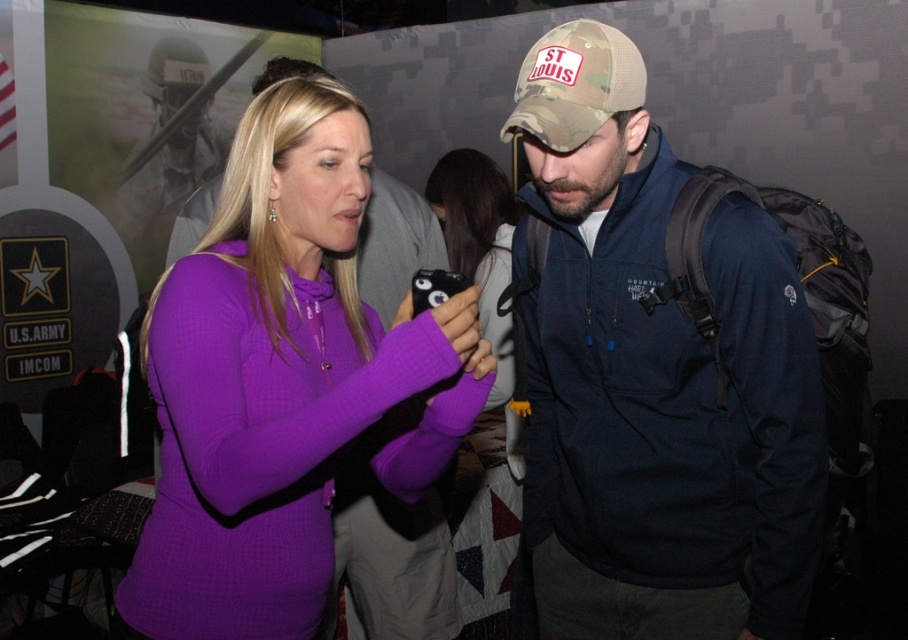
Question: Is purple fleece sweater at center further to camera compared to camo fabric baseball cap at center?

Choices:
 (A) no
 (B) yes

Answer: (A)

Question: Considering the relative positions of camo fabric hat at center and purple fleece sweater at center in the image provided, where is camo fabric hat at center located with respect to purple fleece sweater at center?

Choices:
 (A) below
 (B) above

Answer: (B)

Question: Which object is closer to the camera taking this photo?

Choices:
 (A) camo fabric baseball cap at center
 (B) purple fleece sweater at center
 (C) camo fabric hat at center
 (D) camouflage fabric helmet at upper left

Answer: (B)

Question: Is camo fabric hat at center wider than camouflage fabric helmet at upper left?

Choices:
 (A) yes
 (B) no

Answer: (A)

Question: Which object is farther from the camera taking this photo?

Choices:
 (A) camo fabric baseball cap at center
 (B) camouflage fabric helmet at upper left
 (C) camo fabric hat at center

Answer: (B)

Question: Which of these objects is positioned closest to the camo fabric baseball cap at center?

Choices:
 (A) camo fabric hat at center
 (B) camouflage fabric helmet at upper left

Answer: (A)